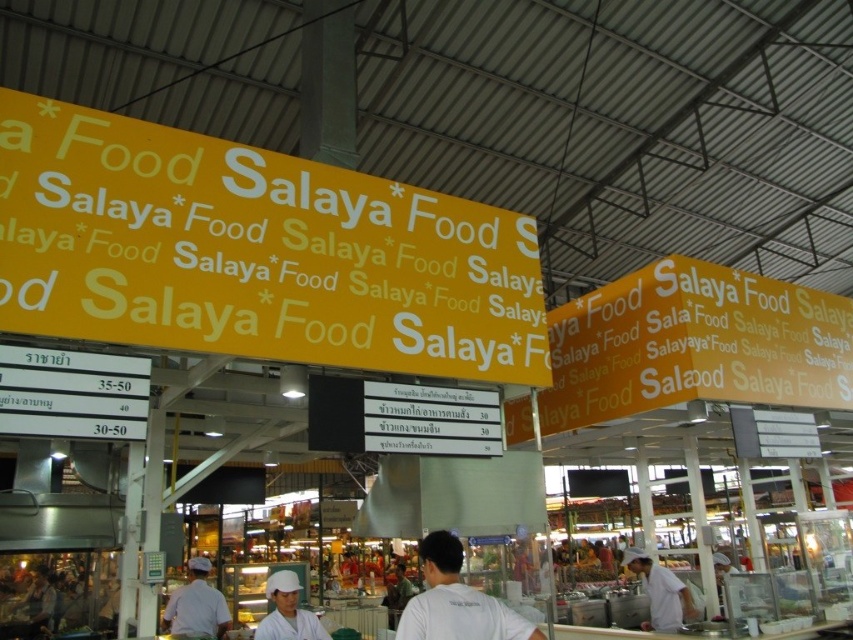
You are a customer at the Salaya Food market and want to know if the yellow fabric sign at upper center is larger than the white matte chef hat at center. Can you confirm this?

The yellow fabric sign at upper center is bigger than the white matte chef hat at center, so yes, the yellow fabric sign at upper center is larger than the white matte chef hat at center.